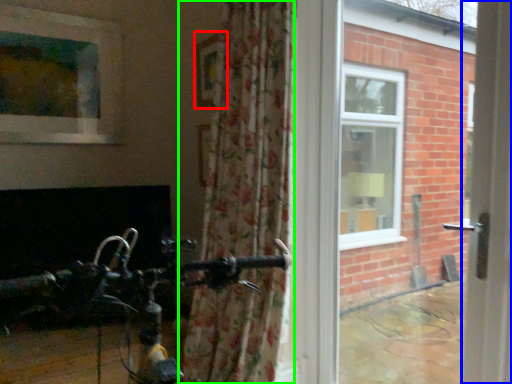
Question: Which object is positioned closest to picture frame (highlighted by a red box)? Select from screen door (highlighted by a blue box) and curtain (highlighted by a green box).

Choices:
 (A) screen door
 (B) curtain

Answer: (B)